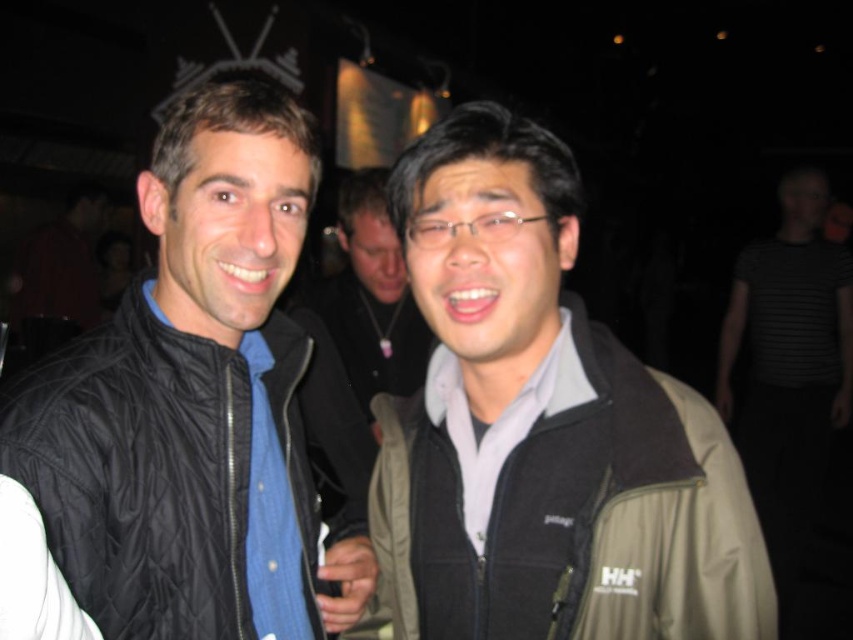
Can you confirm if black striped shirt at right is positioned above matte gray jacket at center?

Incorrect, black striped shirt at right is not positioned above matte gray jacket at center.

Between point (849, 323) and point (378, 216), which one is positioned in front?

Point (378, 216) is in front.

I want to click on black striped shirt at right, so click(788, 368).

Is point (619, 529) farther from viewer compared to point (331, 337)?

No, (619, 529) is in front of (331, 337).

Locate an element on the screen. The width and height of the screenshot is (853, 640). khaki fleece jacket at center is located at coordinates (573, 509).

Find the location of a particular element. The image size is (853, 640). khaki fleece jacket at center is located at coordinates (573, 509).

Who is shorter, black quilted vest at left or khaki fleece jacket at center?

With less height is khaki fleece jacket at center.

This screenshot has height=640, width=853. Describe the element at coordinates (194, 401) in the screenshot. I see `black quilted vest at left` at that location.

Find the location of a particular element. Image resolution: width=853 pixels, height=640 pixels. black quilted vest at left is located at coordinates (194, 401).